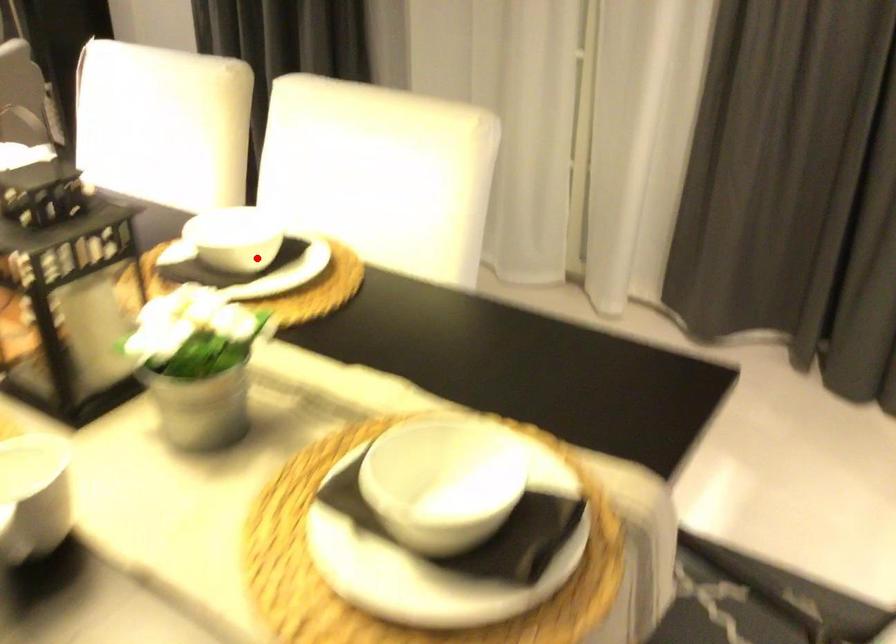
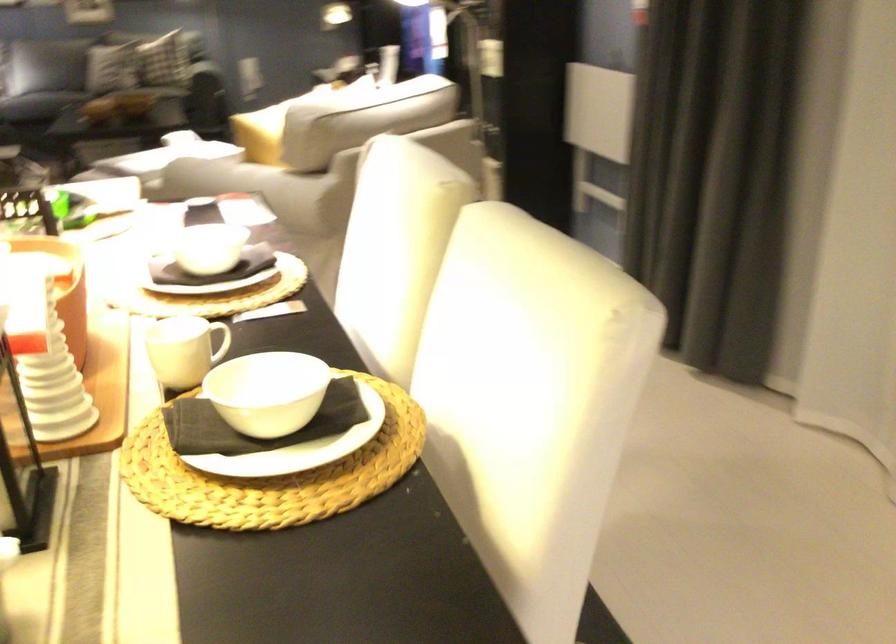
Question: I am providing you with two images of the same scene from different viewpoints. A red point is marked on the first image. Can you still see the location of the red point in image 2?

Choices:
 (A) Yes
 (B) No

Answer: (A)